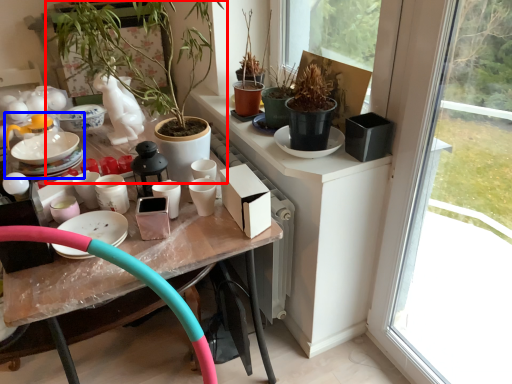
Question: Which object appears farthest to the camera in this image, houseplant (highlighted by a red box) or tea set (highlighted by a blue box)?

Choices:
 (A) houseplant
 (B) tea set

Answer: (B)